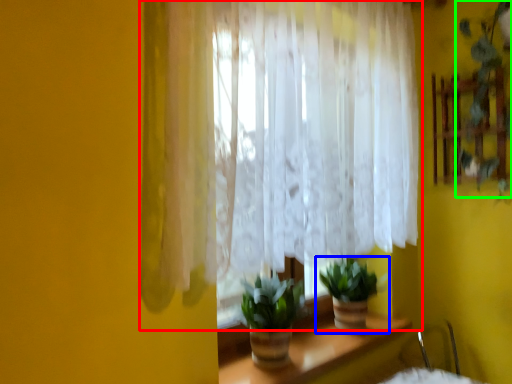
Question: Based on their relative distances, which object is farther from curtain (highlighted by a red box)? Choose from houseplant (highlighted by a blue box) and plant (highlighted by a green box).

Choices:
 (A) houseplant
 (B) plant

Answer: (B)